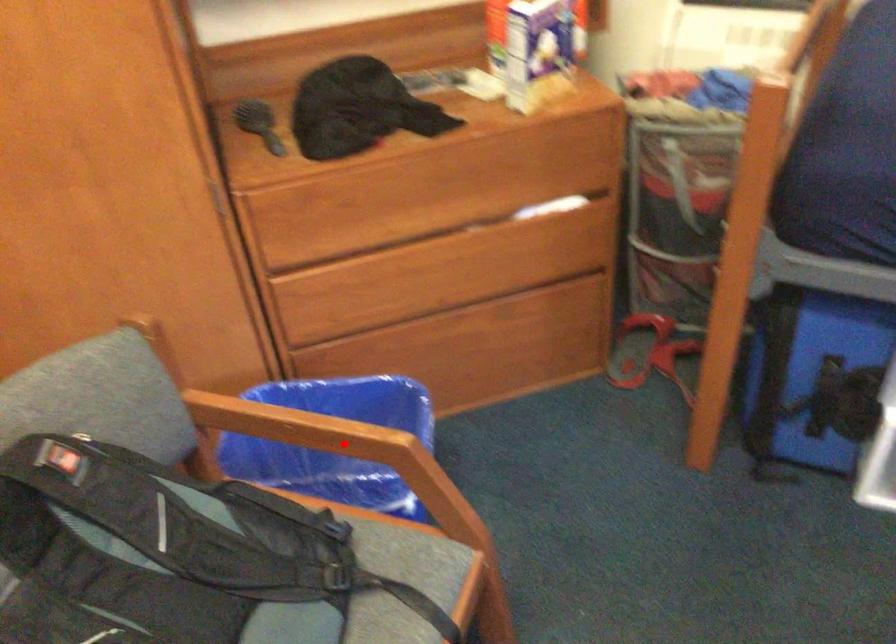
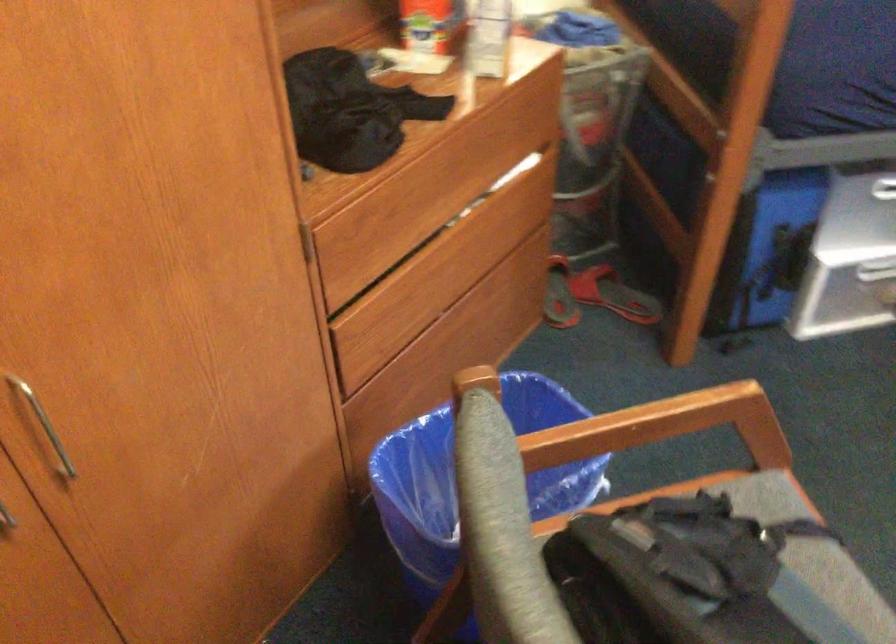
In the second image, find the point that corresponds to the highlighted location in the first image.

(672, 421)